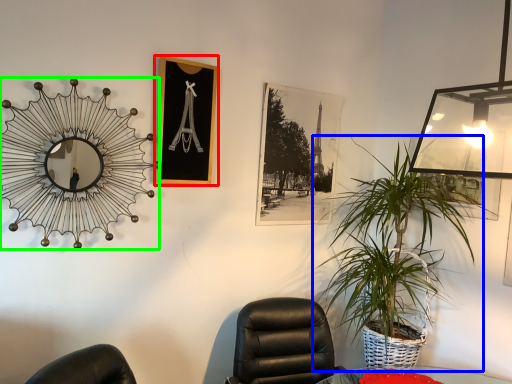
Question: Which object is the farthest from picture frame (highlighted by a red box)? Choose among these: houseplant (highlighted by a blue box) or mirror (highlighted by a green box).

Choices:
 (A) houseplant
 (B) mirror

Answer: (A)